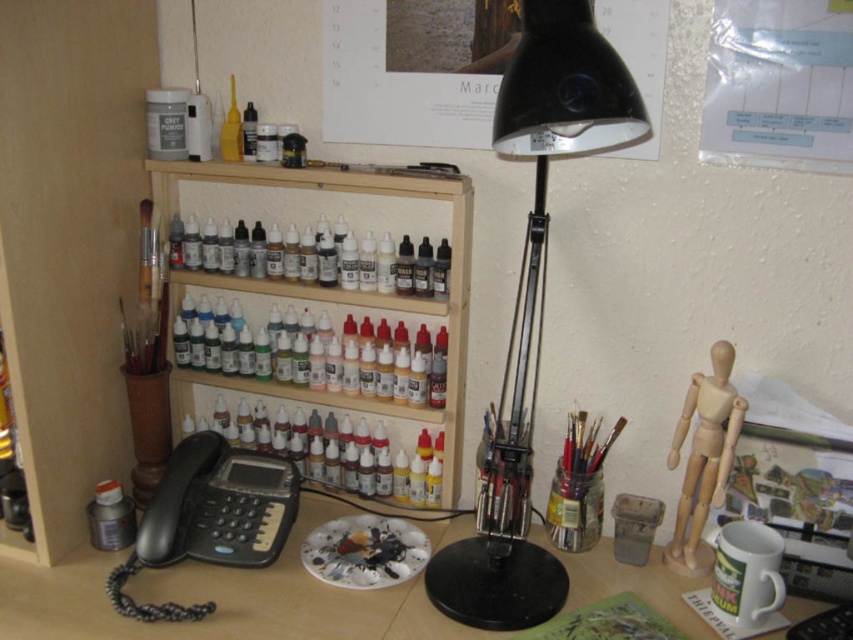
Which is behind, point (558, 65) or point (265, 456)?

The point (265, 456) is more distant.

Locate an element on the screen. black plastic table lamp at center is located at coordinates (532, 307).

Does point (621, 76) lie behind point (213, 609)?

That is False.

Locate an element on the screen. This screenshot has height=640, width=853. black plastic table lamp at center is located at coordinates (532, 307).

Is wooden desk at center closer to the viewer compared to wooden shelf at center?

Yes, it is.

Can you confirm if wooden desk at center is bigger than wooden shelf at center?

Actually, wooden desk at center might be smaller than wooden shelf at center.

Which is behind, point (335, 595) or point (469, 198)?

The point (469, 198) is more distant.

Where is `wooden desk at center`? wooden desk at center is located at coordinates (219, 600).

Can you confirm if wooden desk at center is shorter than black plastic phone at lower left?

Yes, wooden desk at center is shorter than black plastic phone at lower left.

Describe the element at coordinates (219, 600) in the screenshot. I see `wooden desk at center` at that location.

Is point (421, 596) behind point (136, 564)?

No.

In order to click on wooden desk at center in this screenshot , I will do `click(219, 600)`.